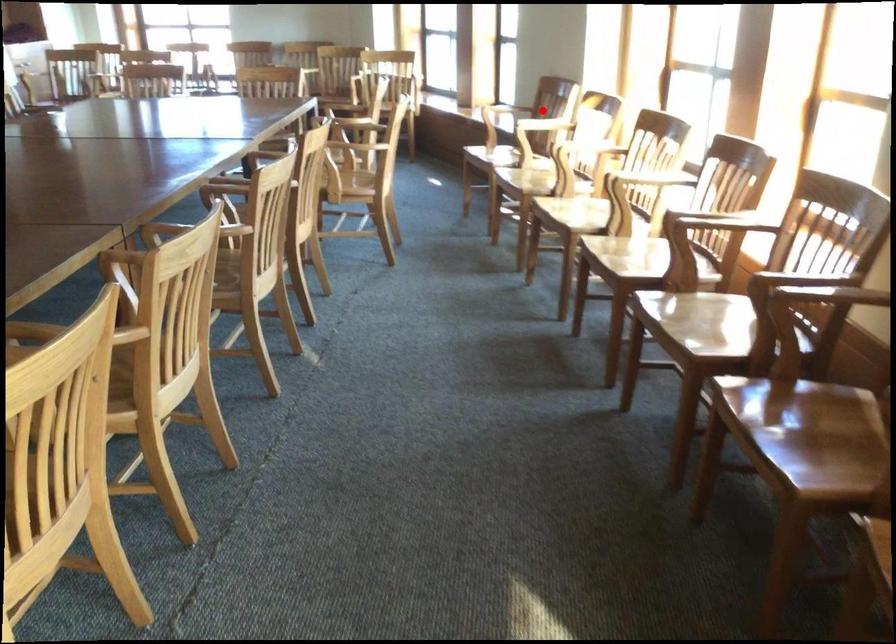
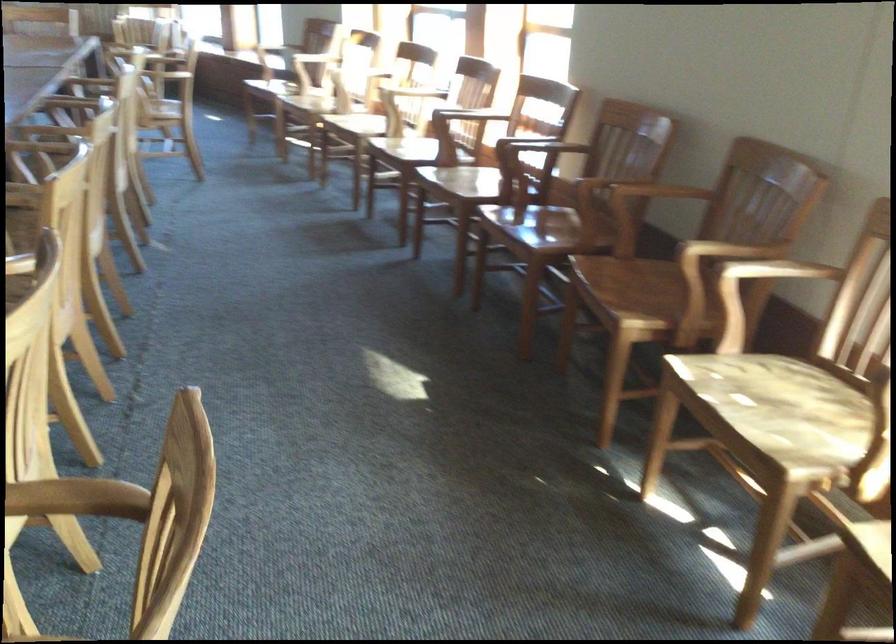
In the second image, find the point that corresponds to the highlighted location in the first image.

(312, 58)